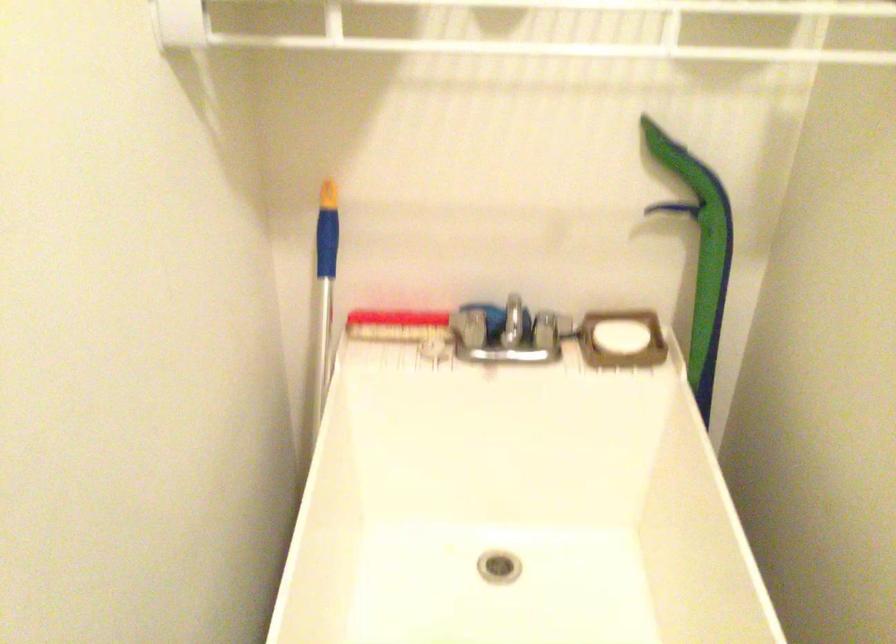
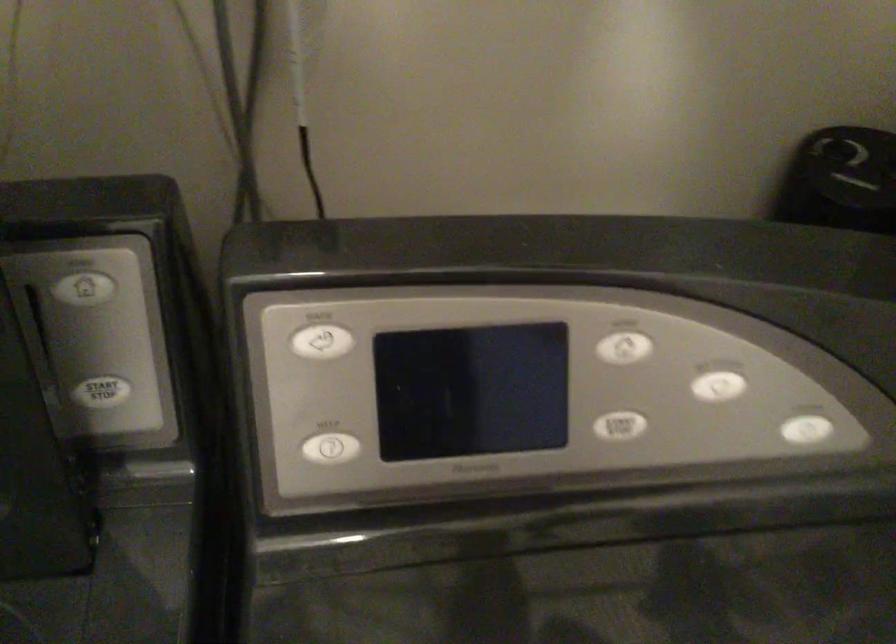
How did the camera likely rotate?

The camera rotated toward right-down.